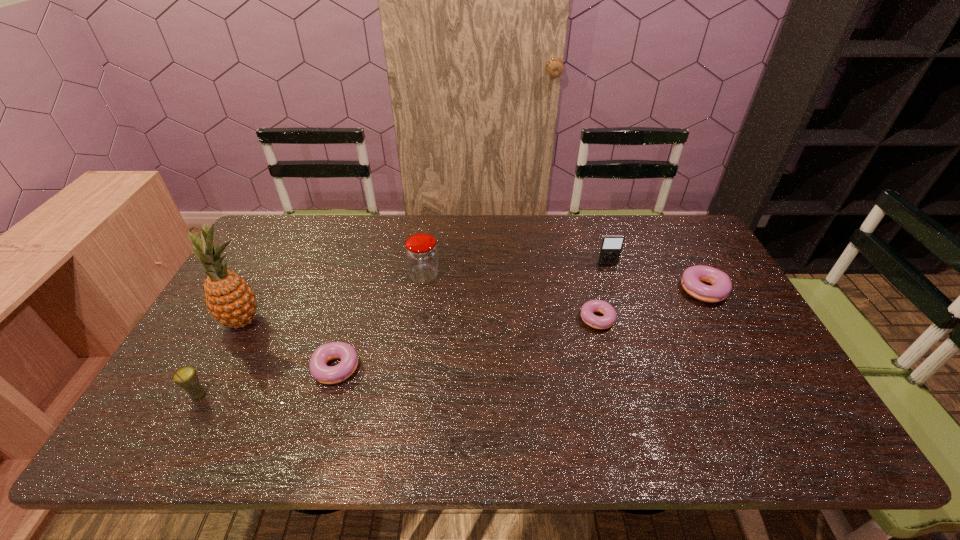
What are the coordinates of `straw for drinking that is at the left edge` in the screenshot? It's located at (186, 377).

In order to click on object positioned at the right edge in this screenshot , I will do pyautogui.click(x=721, y=283).

The height and width of the screenshot is (540, 960). What are the coordinates of `object that is at the near left corner` in the screenshot? It's located at click(x=186, y=377).

In the image, there is a desktop. At what (x,y) coordinates should I click in order to perform the action: click on vacant space at the far edge. Please return your answer as a coordinate pair (x, y). This screenshot has width=960, height=540. Looking at the image, I should click on (516, 248).

Find the location of a particular element. This screenshot has height=540, width=960. free spot at the near edge of the desktop is located at coordinates (637, 402).

In the image, there is a desktop. In order to click on free space at the right edge in this screenshot , I will do `click(758, 332)`.

This screenshot has width=960, height=540. Find the location of `free space at the far left corner of the desktop`. free space at the far left corner of the desktop is located at coordinates (287, 252).

Locate an element on the screen. free space at the near left corner of the desktop is located at coordinates (162, 407).

Image resolution: width=960 pixels, height=540 pixels. Identify the location of vacant space at the far right corner of the desktop. (669, 239).

Identify the location of vacant space at the near right corner of the desktop. Image resolution: width=960 pixels, height=540 pixels. (781, 389).